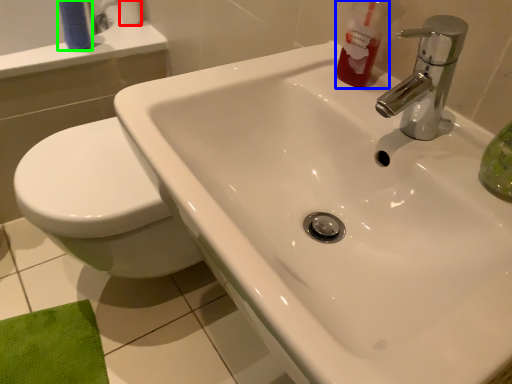
Question: Which object is positioned closest to toilet paper (highlighted by a red box)? Select from cleaning product (highlighted by a blue box) and toiletry (highlighted by a green box).

Choices:
 (A) cleaning product
 (B) toiletry

Answer: (B)